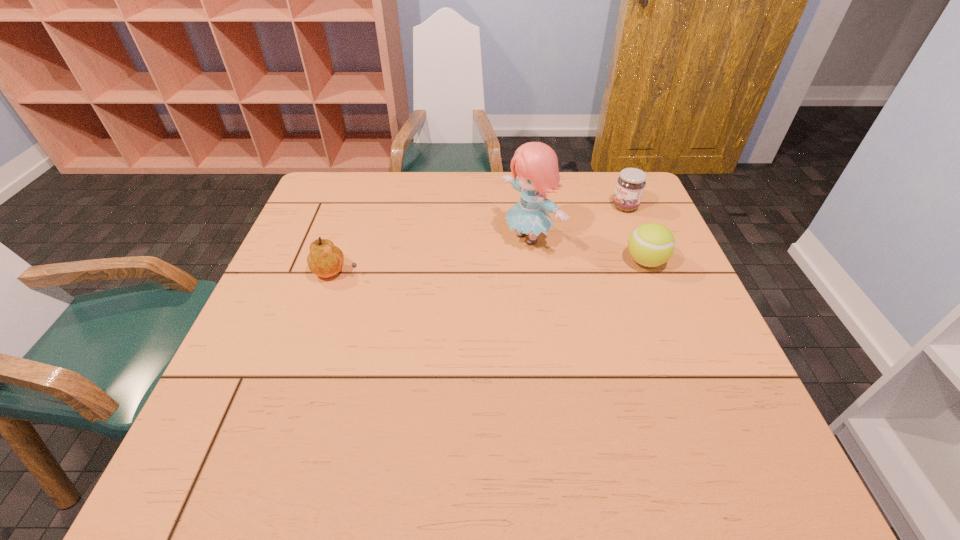
Locate an element on the screen. The width and height of the screenshot is (960, 540). the leftmost object is located at coordinates (325, 260).

I want to click on tennis ball, so click(x=651, y=244).

This screenshot has width=960, height=540. I want to click on jam, so coord(630,185).

This screenshot has height=540, width=960. I want to click on the second object from left to right, so click(x=536, y=164).

Identify the location of doll. The image size is (960, 540). (536, 164).

Locate an element on the screen. The image size is (960, 540). vacant area situated 0.310m on the back of the leftmost object is located at coordinates (363, 194).

This screenshot has width=960, height=540. Find the location of `blank area located on the back of the tennis ball`. blank area located on the back of the tennis ball is located at coordinates (612, 180).

You are a GUI agent. You are given a task and a screenshot of the screen. Output one action in this format:
    pyautogui.click(x=<x>, y=<y>)
    Task: Click on the vacant space positioned on the front label of the jam
    This screenshot has width=960, height=540.
    Given the screenshot: What is the action you would take?
    pyautogui.click(x=564, y=234)

This screenshot has height=540, width=960. In order to click on vacant space located on the front label of the jam in this screenshot , I will do `click(580, 227)`.

You are a GUI agent. You are given a task and a screenshot of the screen. Output one action in this format:
    pyautogui.click(x=<x>, y=<y>)
    Task: Click on the free spot located 0.330m on the front label of the jam
    The image size is (960, 540).
    Given the screenshot: What is the action you would take?
    pyautogui.click(x=527, y=251)